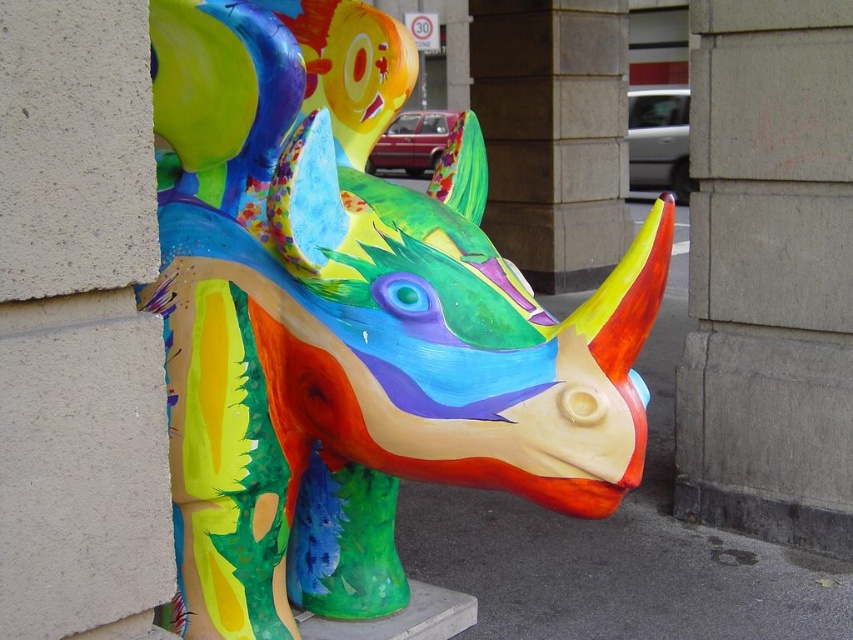
What do you see at coordinates (352, 323) in the screenshot?
I see `multicolored painted rhinoceros at center` at bounding box center [352, 323].

Image resolution: width=853 pixels, height=640 pixels. What do you see at coordinates (352, 323) in the screenshot?
I see `multicolored painted rhinoceros at center` at bounding box center [352, 323].

Find the location of `multicolored painted rhinoceros at center`. multicolored painted rhinoceros at center is located at coordinates (352, 323).